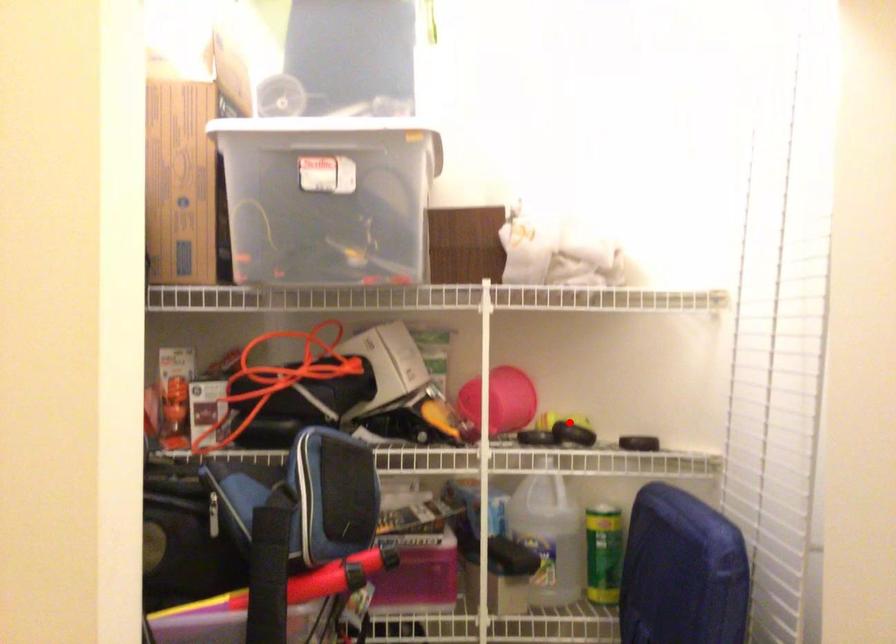
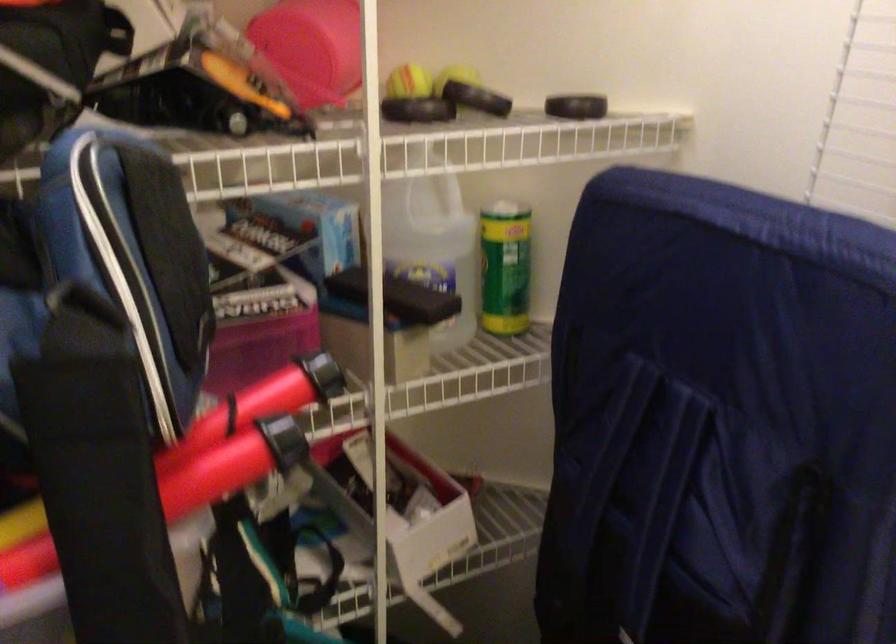
Question: I am providing you with two images of the same scene from different viewpoints. Image1 has a red point marked. In image2, the corresponding 3D location appears at what relative position? Reply with the corresponding letter.

Choices:
 (A) Closer
 (B) Farther

Answer: (A)